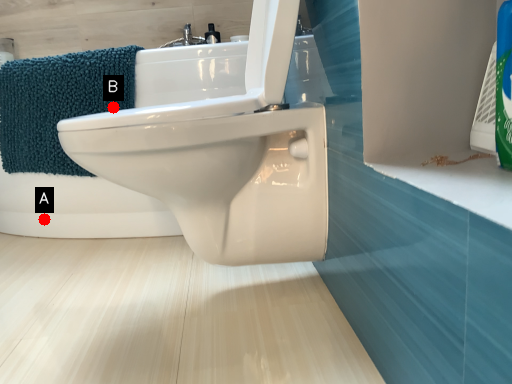
Question: Two points are circled on the image, labeled by A and B beside each circle. Which of the following is the closest to the observer?

Choices:
 (A) A is closer
 (B) B is closer

Answer: (B)